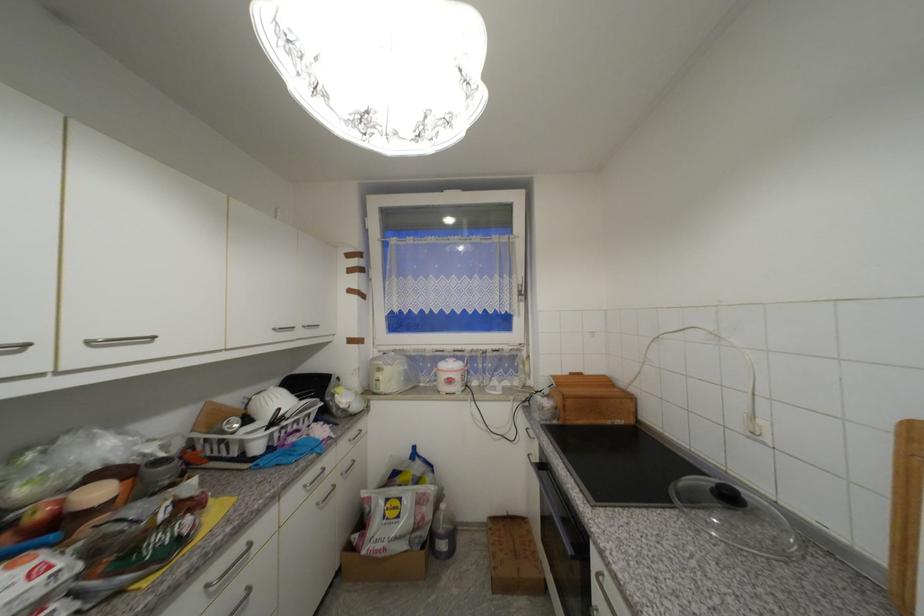
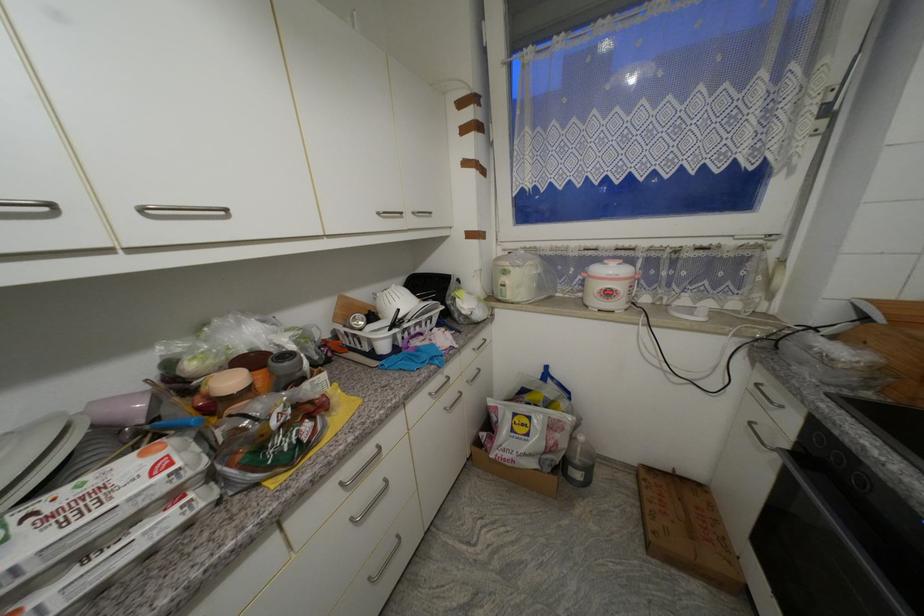
In the second image, find the point that corresponds to point 385,371 in the first image.

(511, 274)